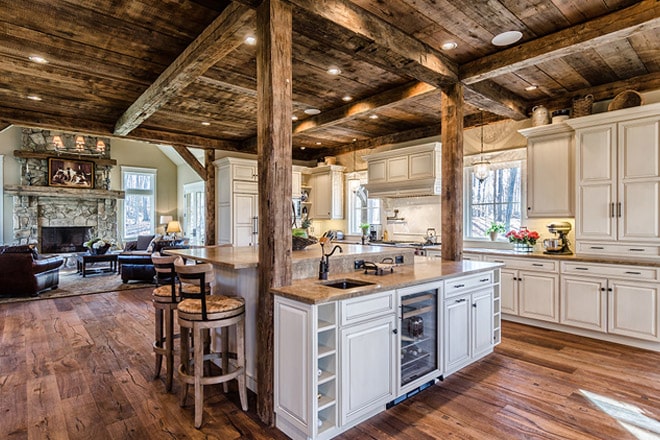
Locate an element on the screen. This screenshot has width=660, height=440. open shelving is located at coordinates (323, 321), (325, 351), (325, 374), (321, 404), (325, 425), (497, 337), (498, 326), (496, 308), (497, 292), (495, 281).